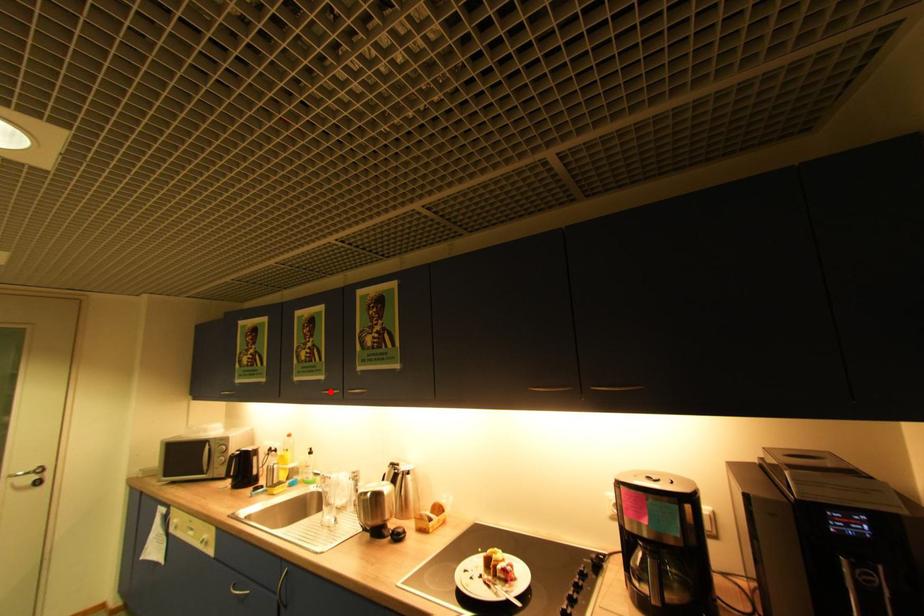
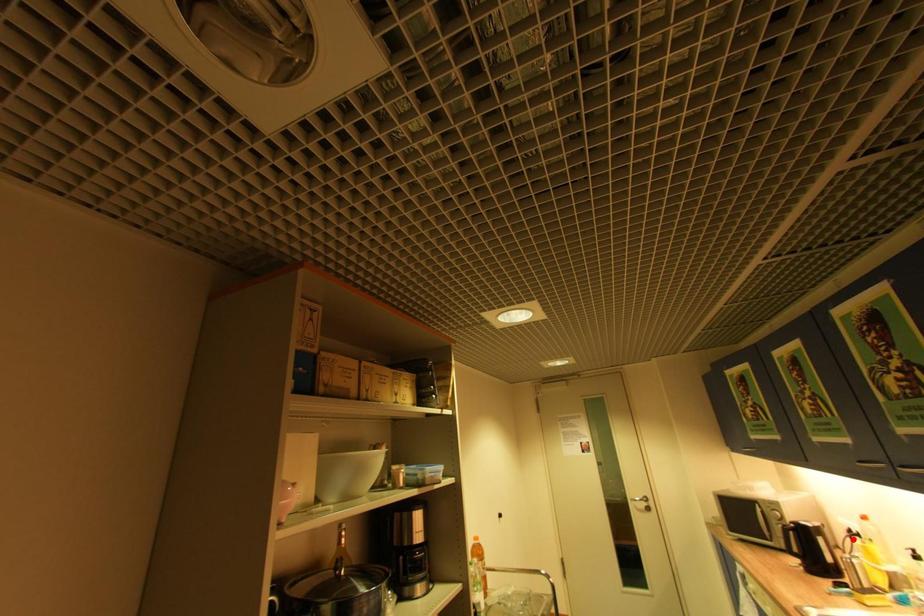
I am providing you with two images of the same scene from different viewpoints. A red point is marked on the first image and another point is marked on the second image. Is the marked point in image1 the same physical position as the marked point in image2?

No